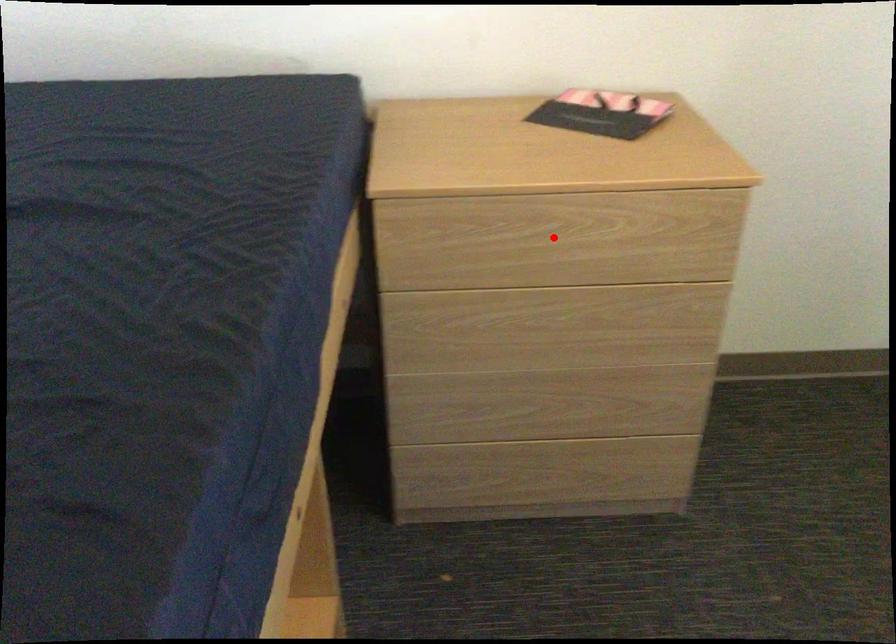
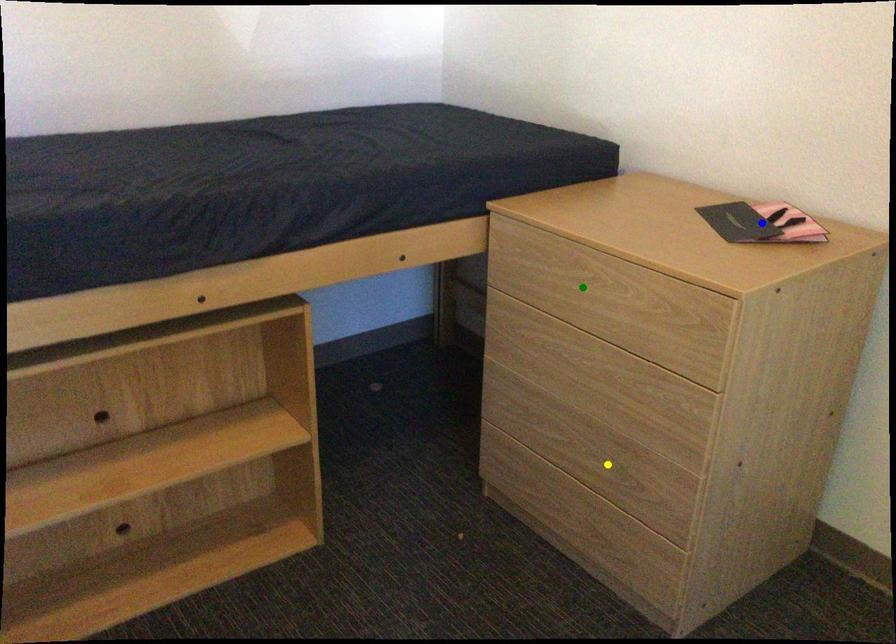
Question: I am providing you with two images of the same scene from different viewpoints. A red point is marked on the first image. You are given multiple points on the second image. Can you choose the point in image 2 that corresponds to the point in image 1?

Choices:
 (A) green point
 (B) blue point
 (C) yellow point

Answer: (A)